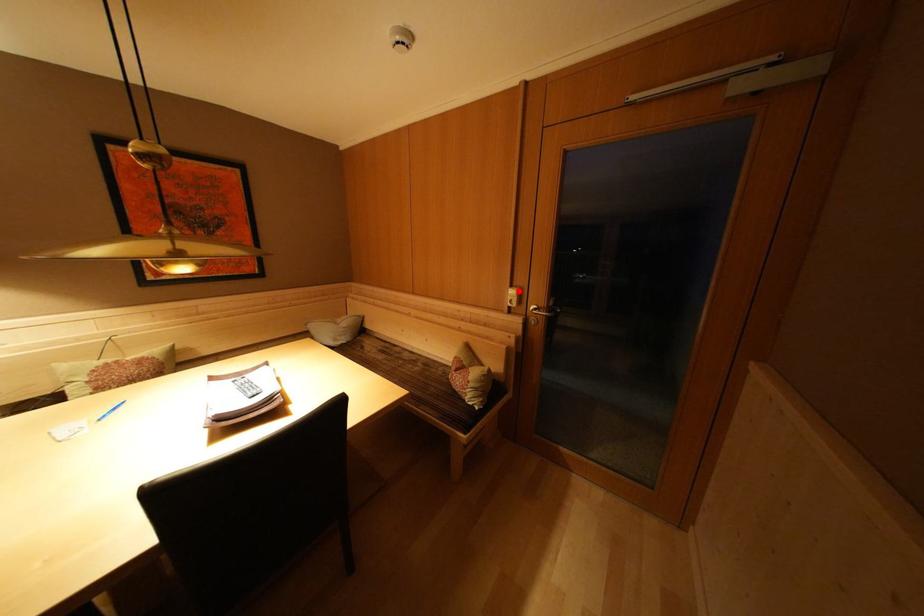
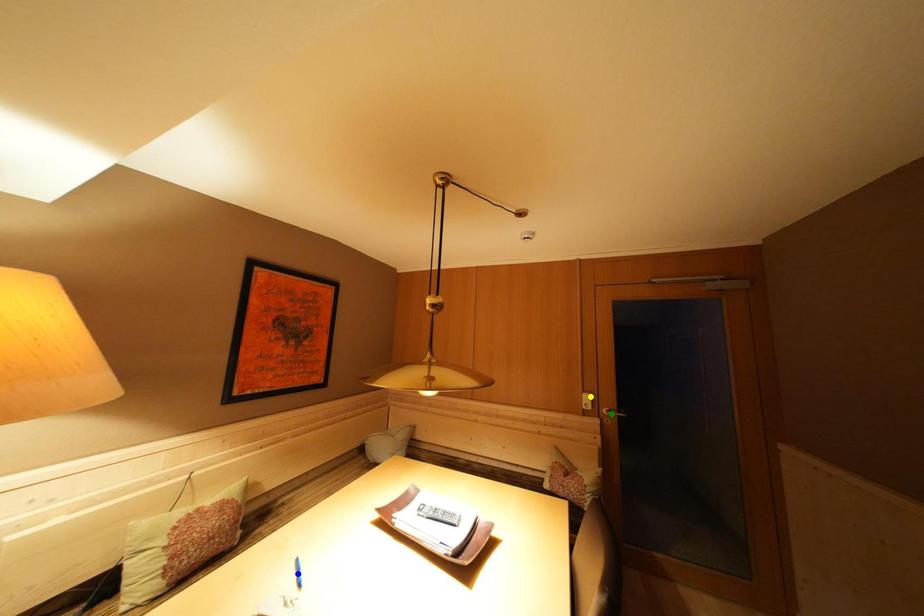
Question: I am providing you with two images of the same scene from different viewpoints. A red point is marked on the first image. You are given multiple points on the second image. In image 2, which mark is for the same physical point as the one in image 1?

Choices:
 (A) blue point
 (B) green point
 (C) yellow point

Answer: (C)